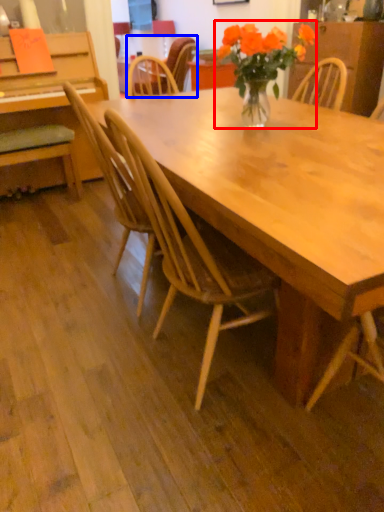
Question: Which point is closer to the camera, houseplant (highlighted by a red box) or chair (highlighted by a blue box)?

Choices:
 (A) houseplant
 (B) chair

Answer: (A)